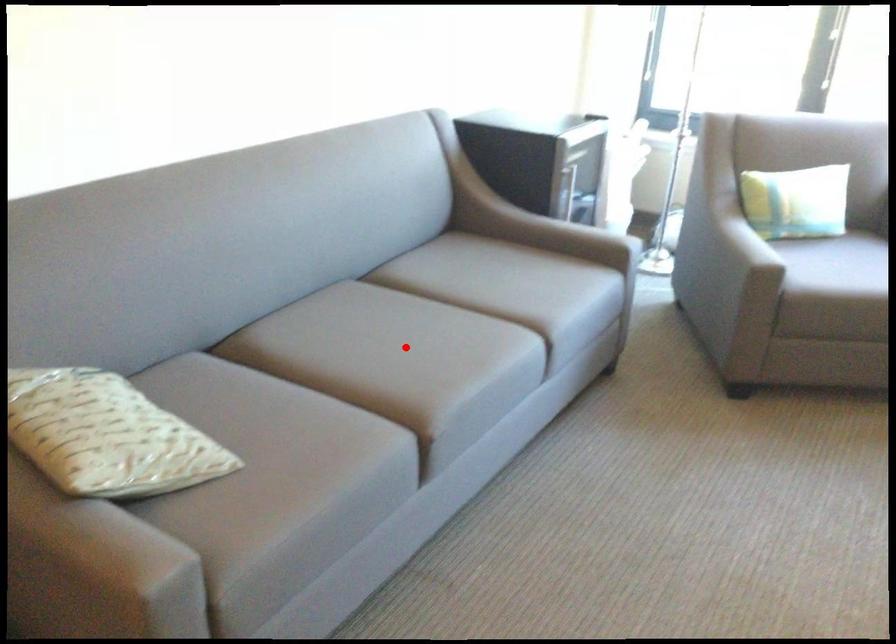
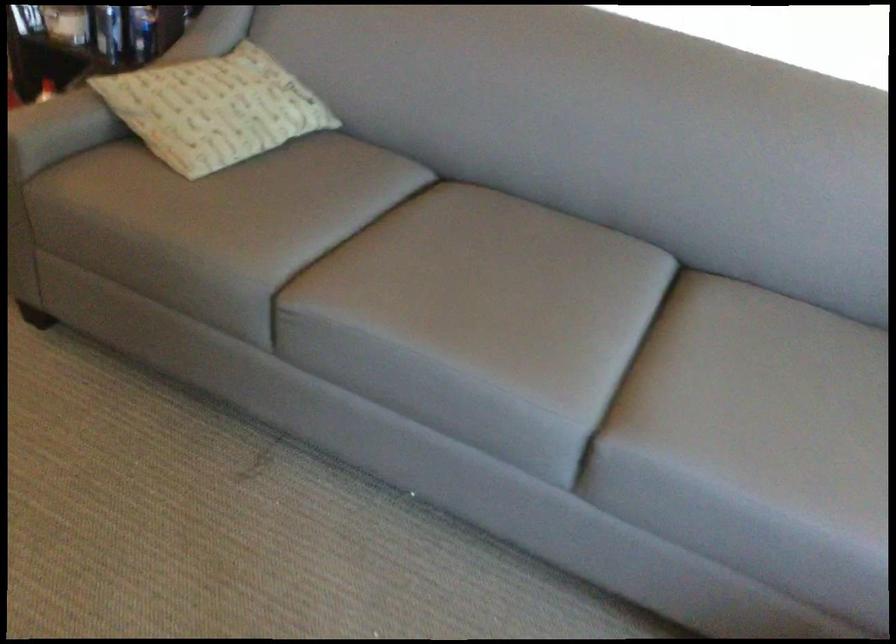
Question: A red point is marked in image1. In image2, is the corresponding 3D point closer to the camera or farther? Reply with the corresponding letter.

Choices:
 (A) The corresponding 3D point is closer.
 (B) The corresponding 3D point is farther.

Answer: (A)